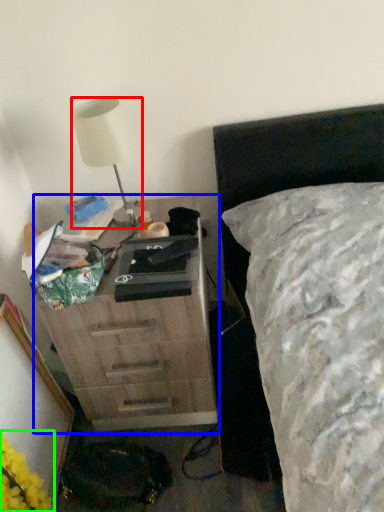
Question: Which object is positioned closest to lamp (highlighted by a red box)? Select from chest of drawers (highlighted by a blue box) and flower (highlighted by a green box).

Choices:
 (A) chest of drawers
 (B) flower

Answer: (A)